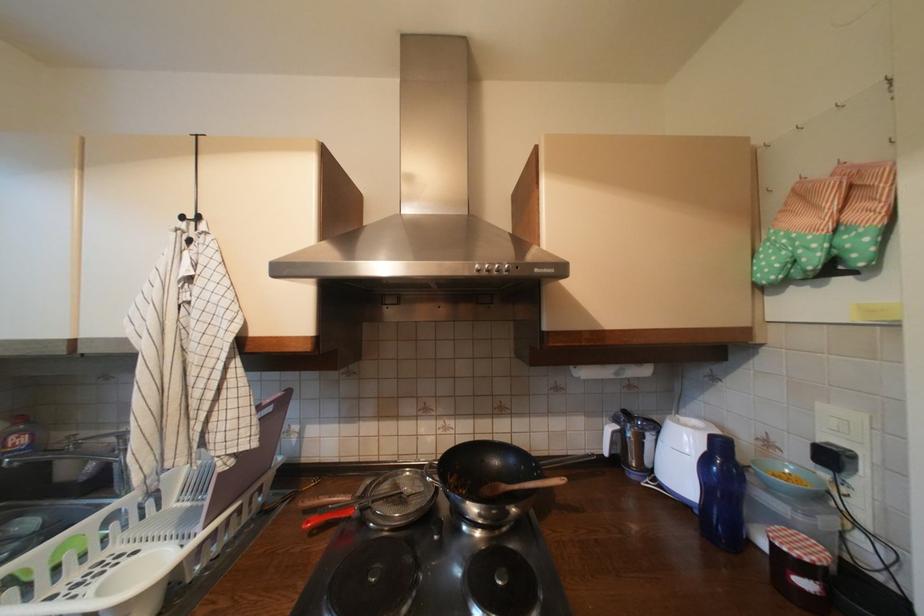
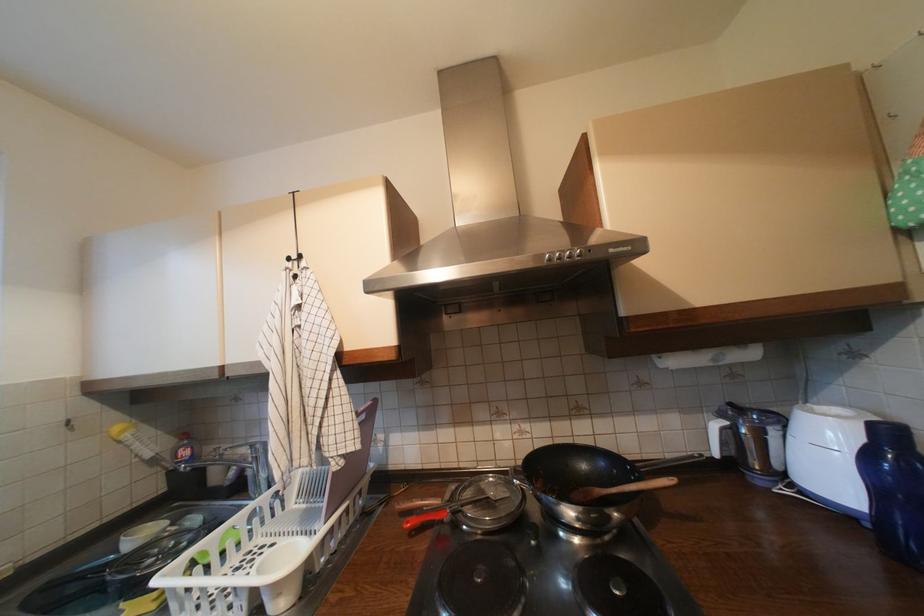
The point at [712,448] is marked in the first image. Where is the corresponding point in the second image?

(870, 440)